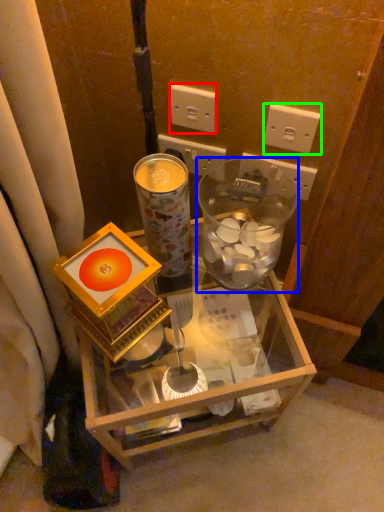
Question: Which object is positioned farthest from power outlet (highlighted by a red box)? Select from glass jar (highlighted by a blue box) and power outlet (highlighted by a green box).

Choices:
 (A) glass jar
 (B) power outlet

Answer: (A)